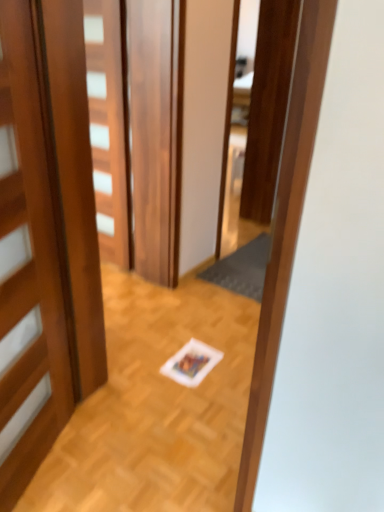
Question: In terms of height, does dark gray textured mat at center look taller or shorter compared to wooden door at center, which is counted as the 2th door, starting from the front?

Choices:
 (A) tall
 (B) short

Answer: (B)

Question: In the image, is dark gray textured mat at center on the left side or the right side of wooden door at center, which is counted as the 2th door, starting from the front?

Choices:
 (A) right
 (B) left

Answer: (A)

Question: Estimate the real-world distances between objects in this image. Which object is closer to the wooden door at left, which is counted as the 2th door, starting from the back?

Choices:
 (A) wooden door at center, which appears as the first door when viewed from the back
 (B) dark gray textured mat at center

Answer: (A)

Question: Estimate the real-world distances between objects in this image. Which object is farther from the wooden door at center, which is counted as the 2th door, starting from the front?

Choices:
 (A) wooden door at left, which is counted as the 2th door, starting from the back
 (B) dark gray textured mat at center

Answer: (A)